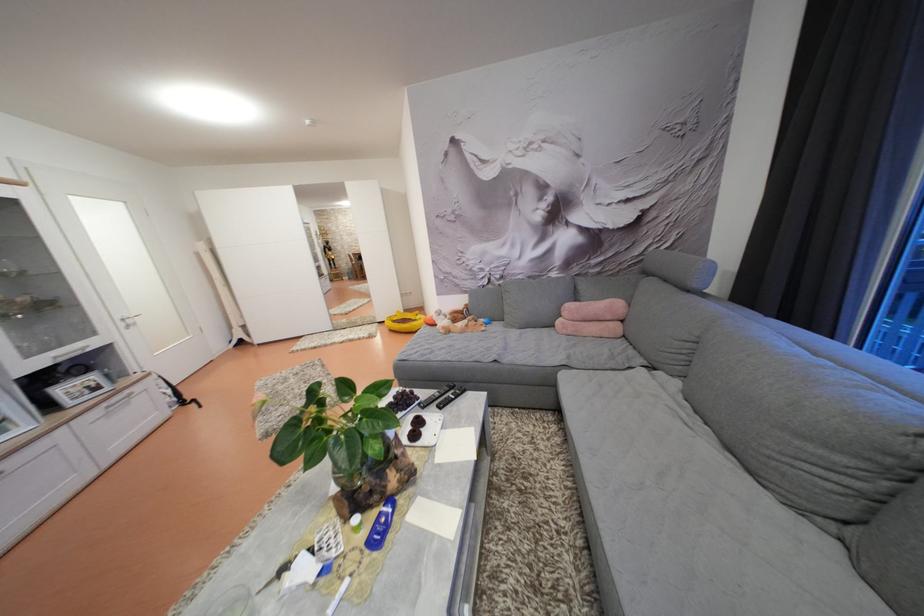
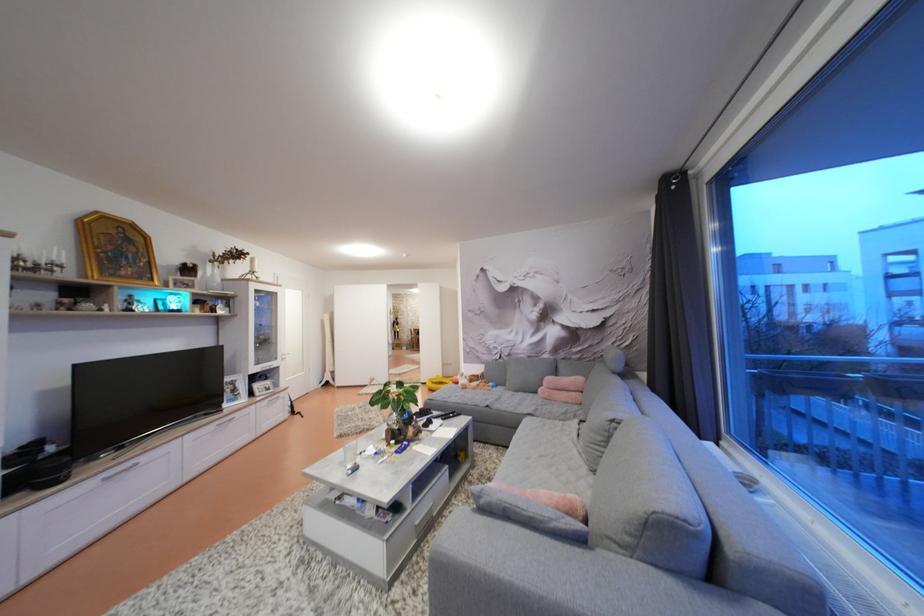
Where in the second image is the point corresponding to (35,361) from the first image?

(263, 370)